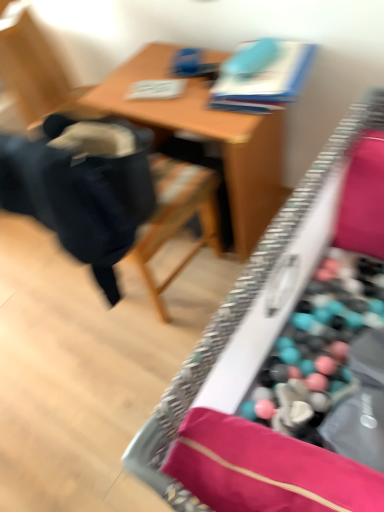
The width and height of the screenshot is (384, 512). I want to click on black fabric chair at left, so click(x=34, y=68).

At what (x,y) coordinates should I click in order to perform the action: click on wooden desk at center. Please return your answer as a coordinate pair (x, y). Looking at the image, I should click on (238, 312).

How much distance is there between wooden desk at center and black fabric chair at left?

22.09 inches.

Does point (349, 141) lie behind point (36, 39)?

No, (349, 141) is closer to viewer.

Is wooden desk at center aimed at black fabric chair at left?

Yes, wooden desk at center is aimed at black fabric chair at left.

Considering the relative sizes of wooden desk at center and black fabric chair at left in the image provided, is wooden desk at center smaller than black fabric chair at left?

Incorrect, wooden desk at center is not smaller in size than black fabric chair at left.

Which is in front, point (280, 204) or point (220, 337)?

The point (220, 337) is in front.

Is wooden table at center not near wooden desk at center?

No, wooden table at center is not far away from wooden desk at center.

Considering the sizes of wooden table at center and wooden desk at center in the image, is wooden table at center bigger or smaller than wooden desk at center?

Considering their sizes, wooden table at center takes up less space than wooden desk at center.

How different are the orientations of wooden table at center and wooden desk at center in degrees?

There is a 90.2-degree angle between the facing directions of wooden table at center and wooden desk at center.

Who is bigger, wooden table at center or black fabric chair at left?

Bigger between the two is black fabric chair at left.

How many degrees apart are the facing directions of wooden table at center and black fabric chair at left?

179 degrees separate the facing orientations of wooden table at center and black fabric chair at left.

At what (x,y) coordinates should I click in order to perform the action: click on chair located in front of the wooden table at center. Please return your answer as a coordinate pair (x, y). The height and width of the screenshot is (512, 384). Looking at the image, I should click on (34, 68).

Would you say black fabric chair at left contains wooden table at center?

No.

From a real-world perspective, is black fabric chair at left over wooden table at center?

Yes, from a real-world perspective, black fabric chair at left is above wooden table at center.

Relative to wooden table at center, is black fabric chair at left in front or behind?

black fabric chair at left is positioned closer to the viewer than wooden table at center.

Consider the image. Is black fabric chair at left smaller than wooden desk at center?

Yes, black fabric chair at left is smaller than wooden desk at center.

Between point (205, 221) and point (276, 221), which one is positioned in front?

The point (276, 221) is in front.

From a real-world perspective, which is physically above, black fabric chair at left or wooden desk at center?

black fabric chair at left.

Is black fabric chair at left oriented towards wooden desk at center?

No, black fabric chair at left is not turned towards wooden desk at center.

Is wooden desk at center oriented away from wooden table at center?

No, wooden desk at center's orientation is not away from wooden table at center.

Is wooden desk at center completely or partially outside of wooden table at center?

wooden desk at center is positioned outside wooden table at center.

Locate an element on the screen. This screenshot has height=512, width=384. desk in front of the wooden table at center is located at coordinates (238, 312).

Where is `desk that is under the black fabric chair at left (from a real-world perspective)`? This screenshot has height=512, width=384. desk that is under the black fabric chair at left (from a real-world perspective) is located at coordinates (238, 312).

Identify the location of table above the wooden desk at center (from the image's perspective). (207, 136).

Based on their spatial positions, is black fabric chair at left or wooden table at center closer to wooden desk at center?

wooden table at center is positioned closer to the anchor wooden desk at center.

Looking at the image, which one is located closer to black fabric chair at left, wooden desk at center or wooden table at center?

wooden table at center is positioned closer to the anchor black fabric chair at left.

Estimate the real-world distances between objects in this image. Which object is further from wooden desk at center, wooden table at center or black fabric chair at left?

black fabric chair at left lies further to wooden desk at center than the other object.

From the image, which object appears to be farther from wooden table at center, wooden desk at center or black fabric chair at left?

wooden desk at center is further to wooden table at center.

Based on the photo, considering their positions, is black fabric chair at left positioned closer to wooden table at center than wooden desk at center?

Based on the image, black fabric chair at left appears to be nearer to wooden table at center.

When comparing their distances from black fabric chair at left, does wooden table at center or wooden desk at center seem further?

wooden desk at center.

Where is `chair positioned between wooden desk at center and wooden table at center from near to far`? The height and width of the screenshot is (512, 384). chair positioned between wooden desk at center and wooden table at center from near to far is located at coordinates (34, 68).